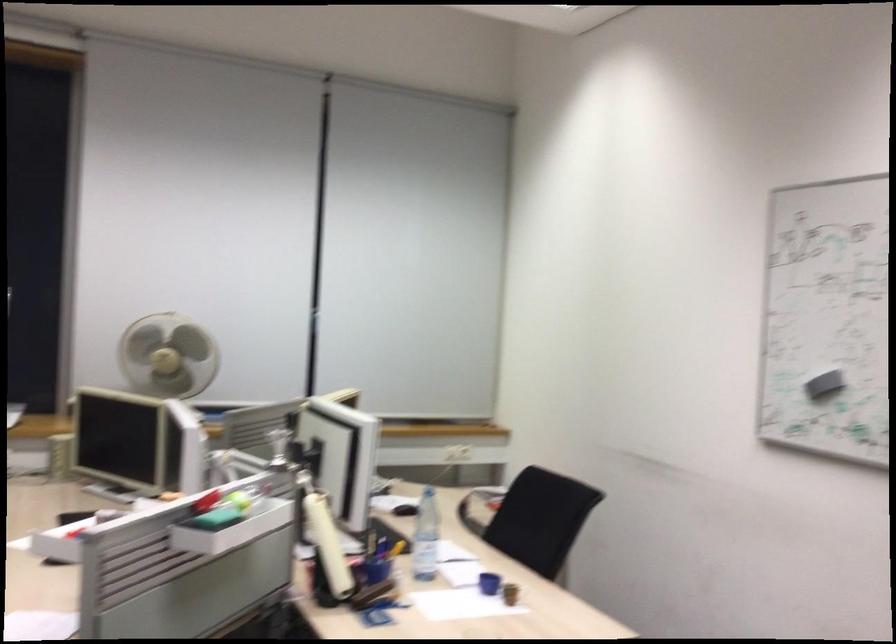
Which object does [168,355] point to?

This point indicates the white desk fan.